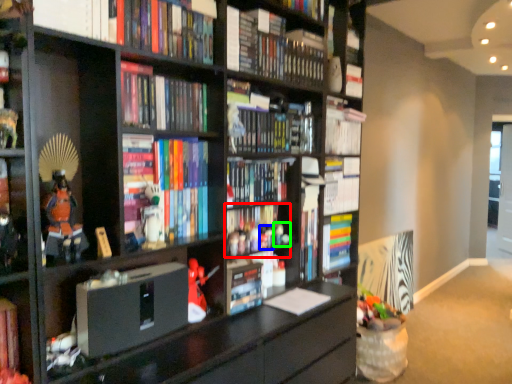
Question: Which object is positioned closest to book (highlighted by a red box)? Select from toy (highlighted by a blue box) and toy (highlighted by a green box).

Choices:
 (A) toy
 (B) toy

Answer: (A)